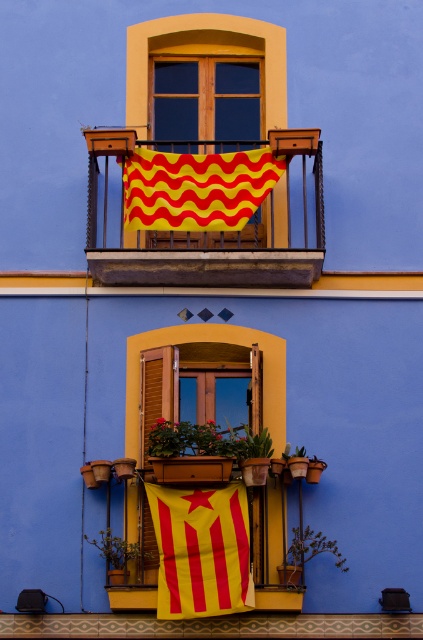
Is point (197, 506) behind point (148, 561)?

No, (197, 506) is closer to viewer.

Does yellowmaterial/textureflag at lower center appear on the left side of wooden at left?

In fact, yellowmaterial/textureflag at lower center is to the right of wooden at left.

Where is `yellowmaterial/textureflag at lower center`? yellowmaterial/textureflag at lower center is located at coordinates (200, 548).

Can you confirm if yellowmaterial/textureflag at lower center is smaller than matte wood window at upper center?

Correct, yellowmaterial/textureflag at lower center occupies less space than matte wood window at upper center.

Does yellowmaterial/textureflag at lower center have a lesser height compared to matte wood window at upper center?

Incorrect, yellowmaterial/textureflag at lower center's height does not fall short of matte wood window at upper center's.

Does point (175, 497) come in front of point (191, 81)?

Yes, point (175, 497) is closer to viewer.

Where is `yellowmaterial/textureflag at lower center`? yellowmaterial/textureflag at lower center is located at coordinates (x=200, y=548).

Which is more to the left, yellow/red striped fabric at upper center or matte wood window at upper center?

From the viewer's perspective, matte wood window at upper center appears more on the left side.

Can you confirm if yellow/red striped fabric at upper center is positioned to the right of matte wood window at upper center?

Yes, yellow/red striped fabric at upper center is to the right of matte wood window at upper center.

Between point (258, 189) and point (216, 129), which one is positioned in front?

Point (258, 189) is more forward.

The width and height of the screenshot is (423, 640). In order to click on yellow/red striped fabric at upper center in this screenshot , I will do `click(197, 188)`.